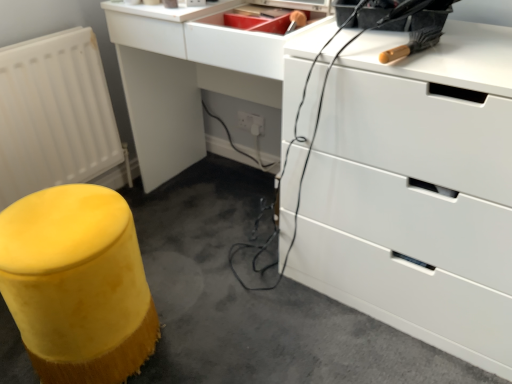
Question: Considering the relative positions of white glossy chest of drawers at upper right and white matte radiator at lower left in the image provided, is white glossy chest of drawers at upper right behind white matte radiator at lower left?

Choices:
 (A) yes
 (B) no

Answer: (B)

Question: From the image's perspective, is white glossy chest of drawers at upper right beneath white matte radiator at lower left?

Choices:
 (A) no
 (B) yes

Answer: (B)

Question: Is white glossy chest of drawers at upper right closer to the viewer compared to white matte radiator at lower left?

Choices:
 (A) no
 (B) yes

Answer: (B)

Question: Is white glossy chest of drawers at upper right at the right side of white matte radiator at lower left?

Choices:
 (A) no
 (B) yes

Answer: (B)

Question: From the image's perspective, is white glossy chest of drawers at upper right located above white matte radiator at lower left?

Choices:
 (A) no
 (B) yes

Answer: (A)

Question: Is white matte radiator at lower left at the back of white glossy chest of drawers at upper right?

Choices:
 (A) no
 (B) yes

Answer: (A)

Question: Is yellow fabric stool at lower left taller than yellow fuzzy stool at lower left?

Choices:
 (A) no
 (B) yes

Answer: (A)

Question: Considering the relative sizes of yellow fabric stool at lower left and yellow fuzzy stool at lower left in the image provided, is yellow fabric stool at lower left wider than yellow fuzzy stool at lower left?

Choices:
 (A) no
 (B) yes

Answer: (B)

Question: Considering the relative positions of yellow fabric stool at lower left and yellow fuzzy stool at lower left in the image provided, is yellow fabric stool at lower left to the right of yellow fuzzy stool at lower left from the viewer's perspective?

Choices:
 (A) yes
 (B) no

Answer: (A)

Question: Is yellow fabric stool at lower left next to yellow fuzzy stool at lower left?

Choices:
 (A) yes
 (B) no

Answer: (B)

Question: Can you confirm if yellow fabric stool at lower left is bigger than yellow fuzzy stool at lower left?

Choices:
 (A) no
 (B) yes

Answer: (B)

Question: Does yellow fabric stool at lower left appear on the left side of yellow fuzzy stool at lower left?

Choices:
 (A) no
 (B) yes

Answer: (A)

Question: Is white matte radiator at lower left at the right side of yellow fuzzy stool at lower left?

Choices:
 (A) no
 (B) yes

Answer: (A)